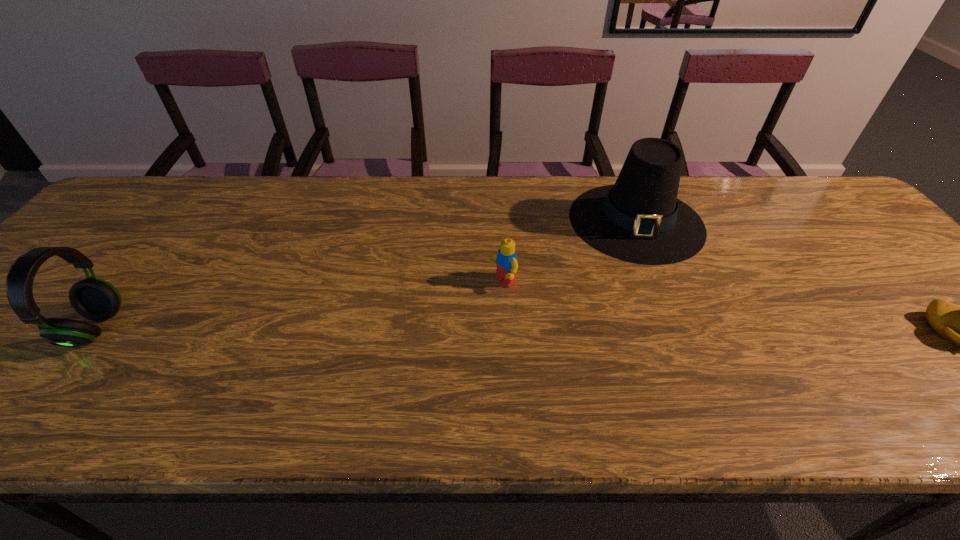
Locate an element on the screen. This screenshot has height=540, width=960. the leftmost object is located at coordinates (95, 299).

The width and height of the screenshot is (960, 540). Identify the location of hat. (639, 219).

The height and width of the screenshot is (540, 960). I want to click on the farthest object, so click(639, 219).

The width and height of the screenshot is (960, 540). What are the coordinates of `the third object from right to left` in the screenshot? It's located at (506, 259).

The image size is (960, 540). In order to click on the third tallest object in this screenshot , I will do 506,259.

Locate an element on the screen. This screenshot has width=960, height=540. free space located on the ear cups of the leftmost object is located at coordinates (146, 328).

The width and height of the screenshot is (960, 540). Identify the location of free space located on the front-facing side of the farthest object. (637, 298).

Where is `free space located 0.240m on the front-facing side of the farthest object`? free space located 0.240m on the front-facing side of the farthest object is located at coordinates (638, 338).

Where is `blank space located on the front-facing side of the farthest object`? This screenshot has width=960, height=540. blank space located on the front-facing side of the farthest object is located at coordinates (637, 298).

Where is `free space located on the front-facing side of the Lego`? This screenshot has height=540, width=960. free space located on the front-facing side of the Lego is located at coordinates (386, 353).